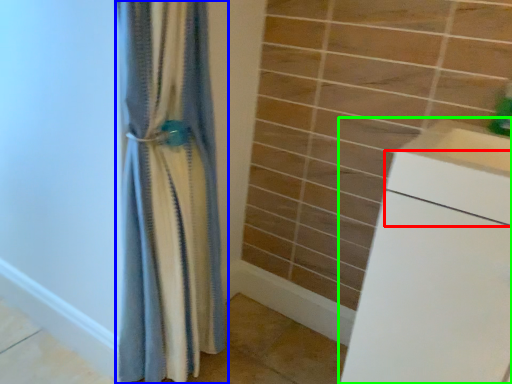
Question: Which object is the closest to the drawer (highlighted by a red box)? Choose among these: curtain (highlighted by a blue box) or counter (highlighted by a green box).

Choices:
 (A) curtain
 (B) counter

Answer: (B)